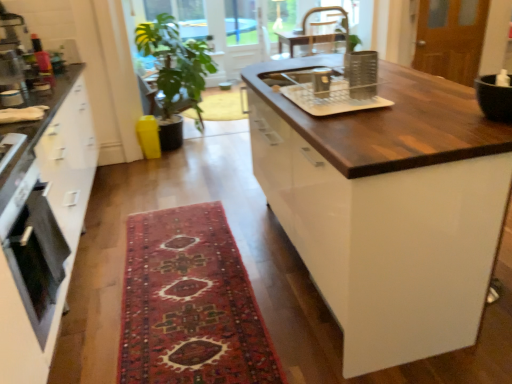
Image resolution: width=512 pixels, height=384 pixels. In order to click on vacant space behind carpeted rug at center in this screenshot , I will do `click(178, 183)`.